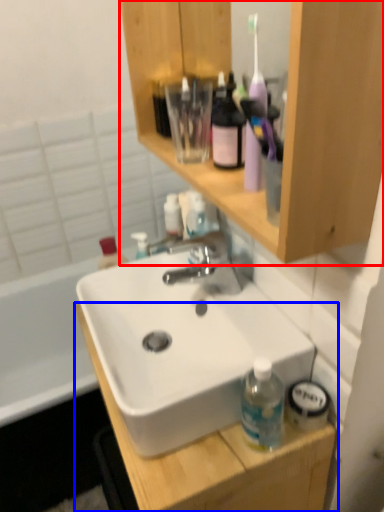
Question: Which object appears closest to the camera in this image, bathroom cabinet (highlighted by a red box) or cabinetry (highlighted by a blue box)?

Choices:
 (A) bathroom cabinet
 (B) cabinetry

Answer: (A)